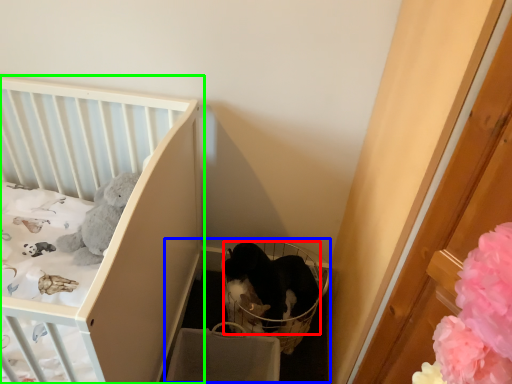
Question: Which is nearer to the cat (highlighted by a red box)? baby carriage (highlighted by a blue box) or infant bed (highlighted by a green box).

Choices:
 (A) baby carriage
 (B) infant bed

Answer: (A)